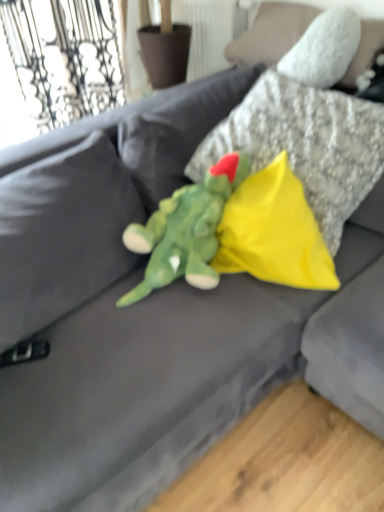
Question: Is yellow fabric pillow at center, which is counted as the second pillow, starting from the top, to the right of soft plush dinosaur at center from the viewer's perspective?

Choices:
 (A) no
 (B) yes

Answer: (B)

Question: Is yellow fabric pillow at center, which is counted as the second pillow, starting from the top, oriented towards soft plush dinosaur at center?

Choices:
 (A) no
 (B) yes

Answer: (A)

Question: Would you say yellow fabric pillow at center, positioned as the 1th pillow in bottom-to-top order, is outside soft plush dinosaur at center?

Choices:
 (A) yes
 (B) no

Answer: (A)

Question: Is yellow fabric pillow at center, positioned as the 1th pillow in bottom-to-top order, wider than soft plush dinosaur at center?

Choices:
 (A) yes
 (B) no

Answer: (A)

Question: From the image's perspective, is yellow fabric pillow at center, which is counted as the second pillow, starting from the top, on top of soft plush dinosaur at center?

Choices:
 (A) yes
 (B) no

Answer: (A)

Question: Considering the relative sizes of yellow fabric pillow at center, positioned as the 1th pillow in bottom-to-top order, and soft plush dinosaur at center in the image provided, is yellow fabric pillow at center, positioned as the 1th pillow in bottom-to-top order, smaller than soft plush dinosaur at center?

Choices:
 (A) yes
 (B) no

Answer: (A)

Question: From a real-world perspective, is soft plush dinosaur at center located beneath yellow fabric pillow at center, positioned as the 1th pillow in bottom-to-top order?

Choices:
 (A) no
 (B) yes

Answer: (A)

Question: Considering the relative positions of soft plush dinosaur at center and yellow fabric pillow at center, positioned as the 1th pillow in bottom-to-top order, in the image provided, is soft plush dinosaur at center to the left of yellow fabric pillow at center, positioned as the 1th pillow in bottom-to-top order, from the viewer's perspective?

Choices:
 (A) no
 (B) yes

Answer: (B)

Question: Considering the relative sizes of soft plush dinosaur at center and yellow fabric pillow at center, positioned as the 1th pillow in bottom-to-top order, in the image provided, is soft plush dinosaur at center thinner than yellow fabric pillow at center, positioned as the 1th pillow in bottom-to-top order,?

Choices:
 (A) yes
 (B) no

Answer: (A)

Question: Is soft plush dinosaur at center positioned beyond the bounds of yellow fabric pillow at center, which is counted as the second pillow, starting from the top?

Choices:
 (A) yes
 (B) no

Answer: (A)

Question: Is the depth of soft plush dinosaur at center greater than that of yellow fabric pillow at center, positioned as the 1th pillow in bottom-to-top order?

Choices:
 (A) yes
 (B) no

Answer: (B)

Question: Is the position of soft plush dinosaur at center less distant than that of yellow fabric pillow at center, which is counted as the second pillow, starting from the top?

Choices:
 (A) no
 (B) yes

Answer: (B)

Question: Can you confirm if yellow fabric pillow at center, which is counted as the second pillow, starting from the top, is shorter than yellow fabric pillow at center, the 1th pillow viewed from the top?

Choices:
 (A) yes
 (B) no

Answer: (A)